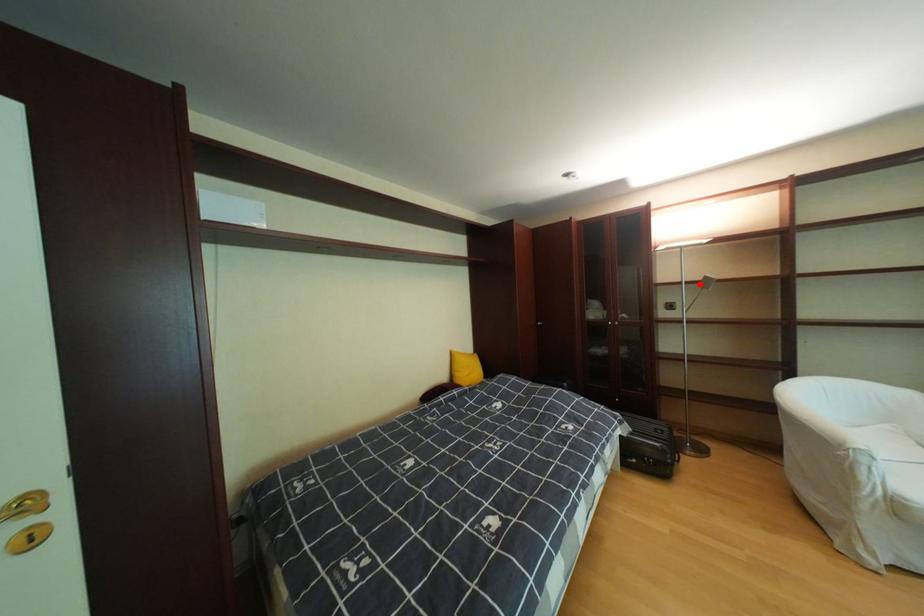
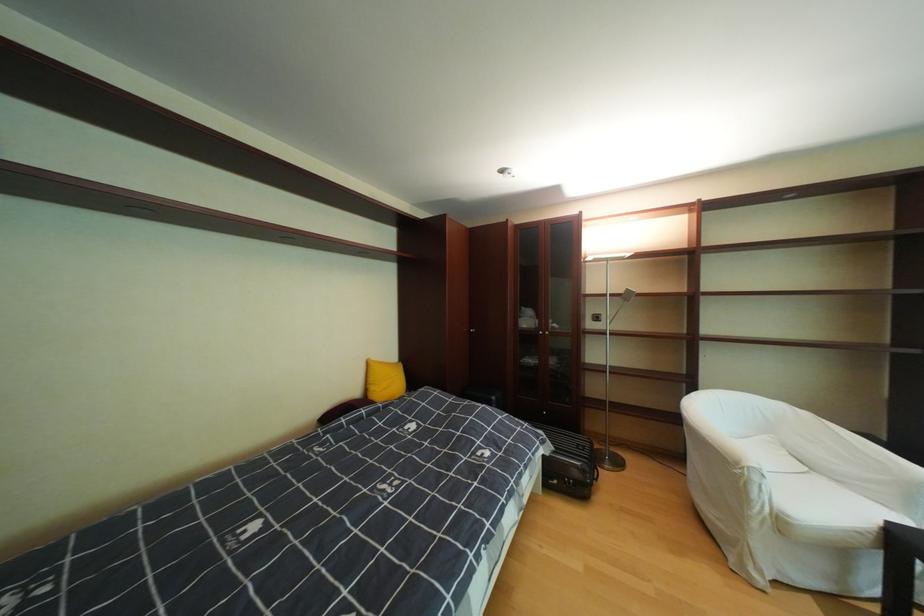
Find the pixel in the second image that matches the highlighted location in the first image.

(624, 296)